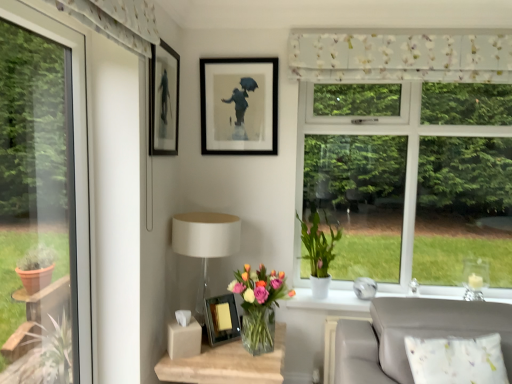
Question: Is white matte pot at window, the 2th houseplant from the left, wider or thinner than matte black picture frame at upper left, which is the second picture frame in top-to-bottom order?

Choices:
 (A) thin
 (B) wide

Answer: (B)

Question: Is white matte pot at window, the 2th houseplant from the left, to the left or to the right of matte black picture frame at upper left, which is the 2th picture frame from bottom to top, in the image?

Choices:
 (A) right
 (B) left

Answer: (A)

Question: Which object is positioned farthest from the translucent glass vase at lower center, which is the first houseplant from left to right?

Choices:
 (A) matte white table lamp at center
 (B) translucent glass vase at lower center
 (C) matte black picture frame at upper left, which is the second picture frame in top-to-bottom order
 (D) matte black frame at upper center, the 3th picture frame ordered from the bottom
 (E) floral fabric curtain at upper center

Answer: (E)

Question: Estimate the real-world distances between objects in this image. Which object is closer to the matte black frame at upper center, placed as the first picture frame when sorted from top to bottom?

Choices:
 (A) matte black picture frame at upper left, which is the 2th picture frame from bottom to top
 (B) metallic silver picture frame at center, arranged as the third picture frame when viewed from the top
 (C) white fabric couch at lower right
 (D) translucent glass vase at lower center, arranged as the 1th houseplant when viewed from the front
 (E) matte white table lamp at center

Answer: (A)